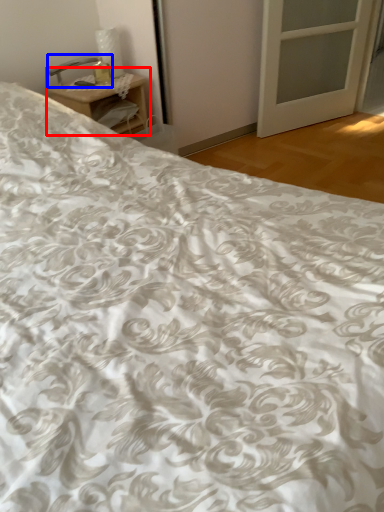
Question: Which object is closer to the camera taking this photo, nightstand (highlighted by a red box) or table lamp (highlighted by a blue box)?

Choices:
 (A) nightstand
 (B) table lamp

Answer: (A)